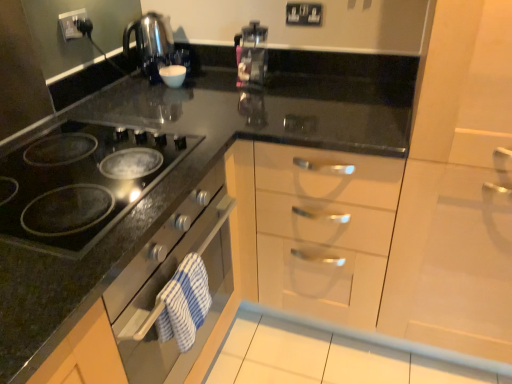
Question: From the image's perspective, is transparent plastic coffee machine at center beneath white glossy cabinet at right?

Choices:
 (A) yes
 (B) no

Answer: (B)

Question: Is transparent plastic coffee machine at center closer to the viewer compared to white glossy cabinet at right?

Choices:
 (A) no
 (B) yes

Answer: (A)

Question: Is transparent plastic coffee machine at center bigger than white glossy cabinet at right?

Choices:
 (A) no
 (B) yes

Answer: (A)

Question: Can you confirm if transparent plastic coffee machine at center is smaller than white glossy cabinet at right?

Choices:
 (A) no
 (B) yes

Answer: (B)

Question: From a real-world perspective, does transparent plastic coffee machine at center stand above white glossy cabinet at right?

Choices:
 (A) no
 (B) yes

Answer: (B)

Question: Is transparent plastic coffee machine at center located outside white glossy cabinet at right?

Choices:
 (A) yes
 (B) no

Answer: (A)

Question: Can you confirm if black plastic electric outlet at upper center, the first electric outlet in the right-to-left sequence, is positioned to the right of white glossy cabinet at right?

Choices:
 (A) yes
 (B) no

Answer: (B)

Question: From a real-world perspective, is black plastic electric outlet at upper center, the first electric outlet in the right-to-left sequence, positioned under white glossy cabinet at right based on gravity?

Choices:
 (A) no
 (B) yes

Answer: (A)

Question: Would you consider black plastic electric outlet at upper center, positioned as the 1th electric outlet in back-to-front order, to be distant from white glossy cabinet at right?

Choices:
 (A) no
 (B) yes

Answer: (A)

Question: Is black plastic electric outlet at upper center, the first electric outlet in the right-to-left sequence, closer to camera compared to white glossy cabinet at right?

Choices:
 (A) no
 (B) yes

Answer: (A)

Question: Is black plastic electric outlet at upper center, marked as the 2th electric outlet in a front-to-back arrangement, bigger than white glossy cabinet at right?

Choices:
 (A) yes
 (B) no

Answer: (B)

Question: Considering the relative sizes of black plastic electric outlet at upper center, the first electric outlet in the right-to-left sequence, and white glossy cabinet at right in the image provided, is black plastic electric outlet at upper center, the first electric outlet in the right-to-left sequence, taller than white glossy cabinet at right?

Choices:
 (A) yes
 (B) no

Answer: (B)

Question: Is black plastic electric outlet at upper left, which is counted as the first electric outlet, starting from the left, completely or partially outside of black glass cooktop at left?

Choices:
 (A) yes
 (B) no

Answer: (A)